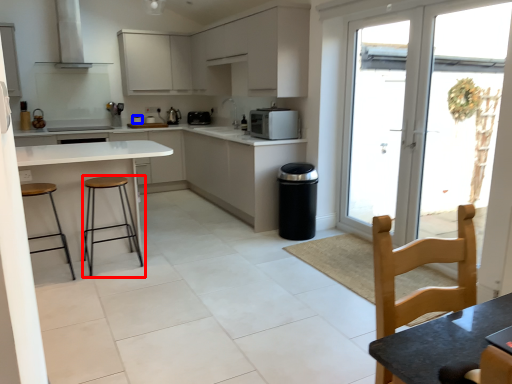
Question: Which of the following is the farthest to the observer, stool (highlighted by a red box) or appliance (highlighted by a blue box)?

Choices:
 (A) stool
 (B) appliance

Answer: (B)